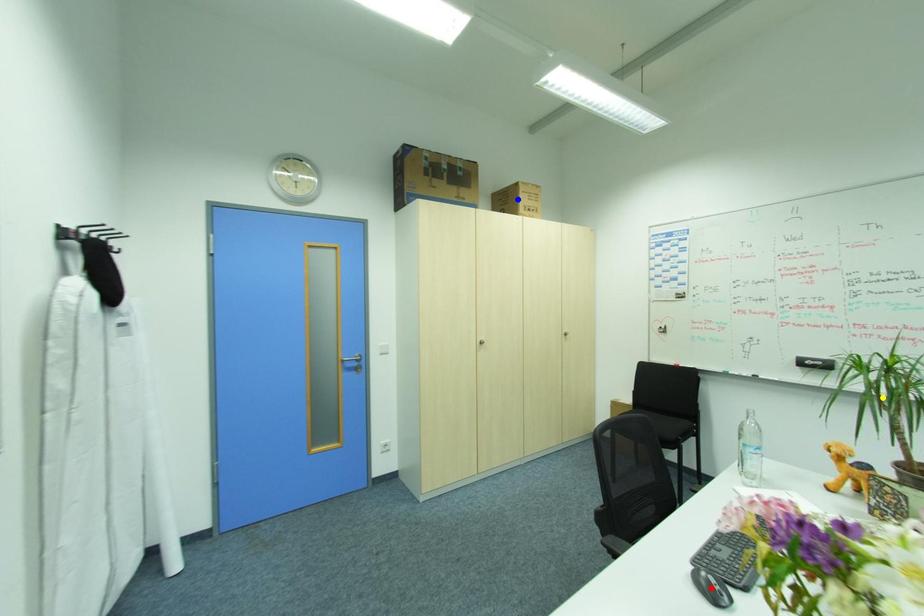
Order these from farthest to nearest:
red point | yellow point | blue point

blue point → yellow point → red point